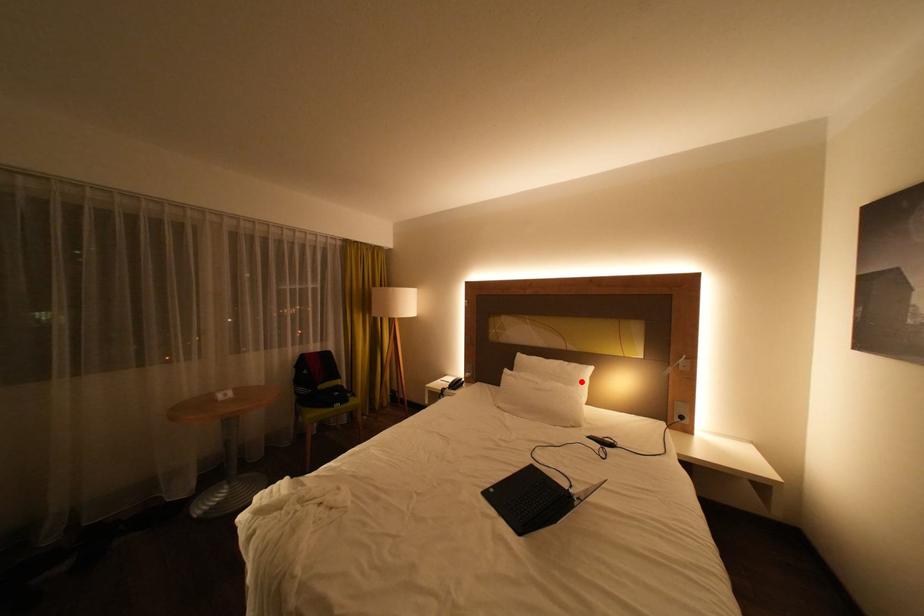
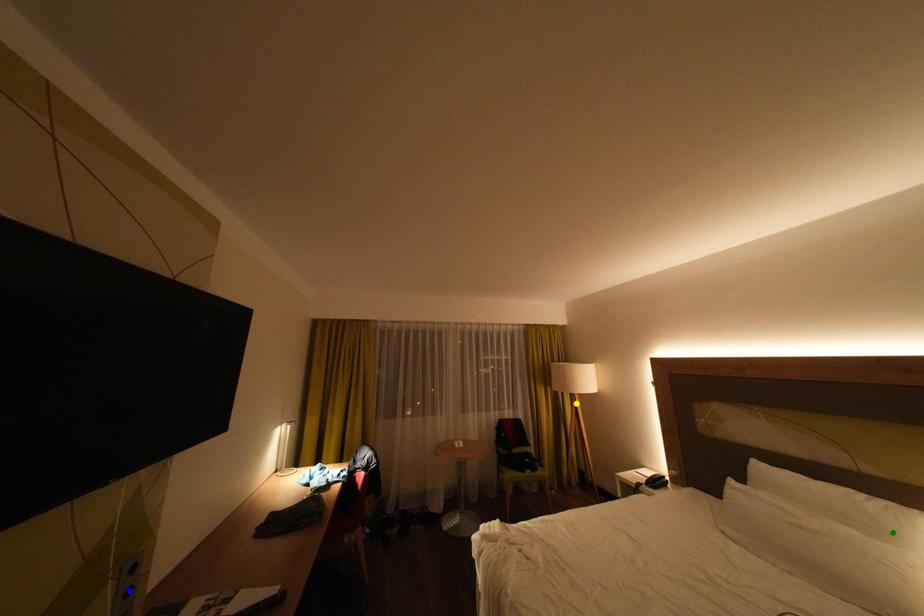
Question: I am providing you with two images of the same scene from different viewpoints. A red point is marked on the first image. You are given multiple points on the second image. Which mark in image 2 goes with the point in image 1?

Choices:
 (A) yellow point
 (B) green point
 (C) blue point

Answer: (B)